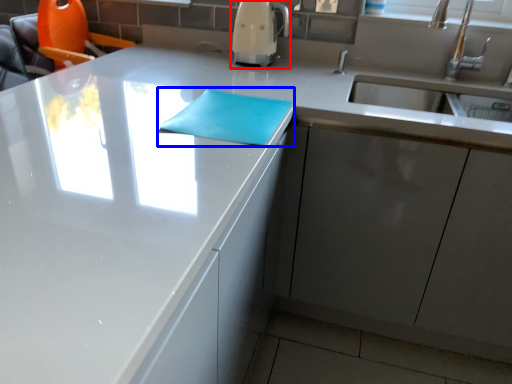
Question: Which point is closer to the camera, coffee machine (highlighted by a red box) or notepad (highlighted by a blue box)?

Choices:
 (A) coffee machine
 (B) notepad

Answer: (B)